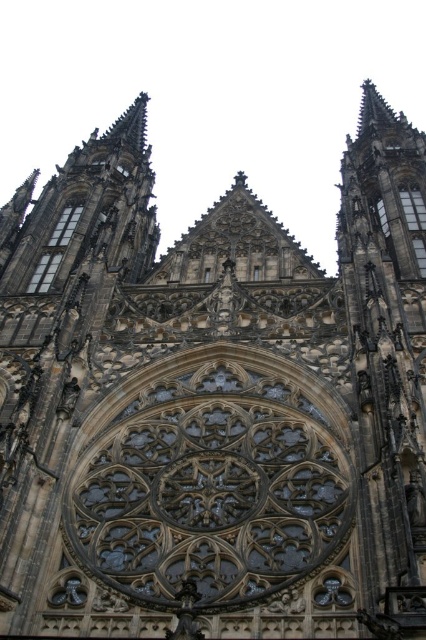
Can you confirm if clear glass window at left is bigger than transparent glass window at upper right?

Yes, clear glass window at left is bigger than transparent glass window at upper right.

Who is positioned more to the left, clear glass window at left or transparent glass window at upper right?

clear glass window at left

Who is more forward, [57,230] or [416,216]?

Positioned in front is point [416,216].

Identify the location of clear glass window at left. Image resolution: width=426 pixels, height=640 pixels. (54, 250).